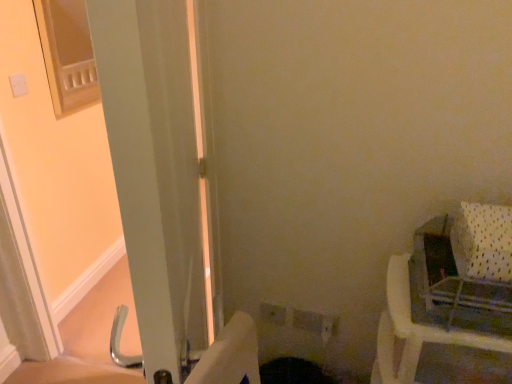
Question: Relative to white plastic baby carriage at right, is white glossy screen door at left in front or behind?

Choices:
 (A) behind
 (B) front

Answer: (B)

Question: Is point (168, 84) positioned closer to the camera than point (495, 223)?

Choices:
 (A) closer
 (B) farther

Answer: (A)

Question: Which of these objects is positioned farthest from the white glossy screen door at left?

Choices:
 (A) white plastic baby carriage at right
 (B) white plastic chair at right

Answer: (A)

Question: Based on their relative distances, which object is nearer to the white plastic chair at right?

Choices:
 (A) white plastic baby carriage at right
 (B) white glossy screen door at left

Answer: (A)